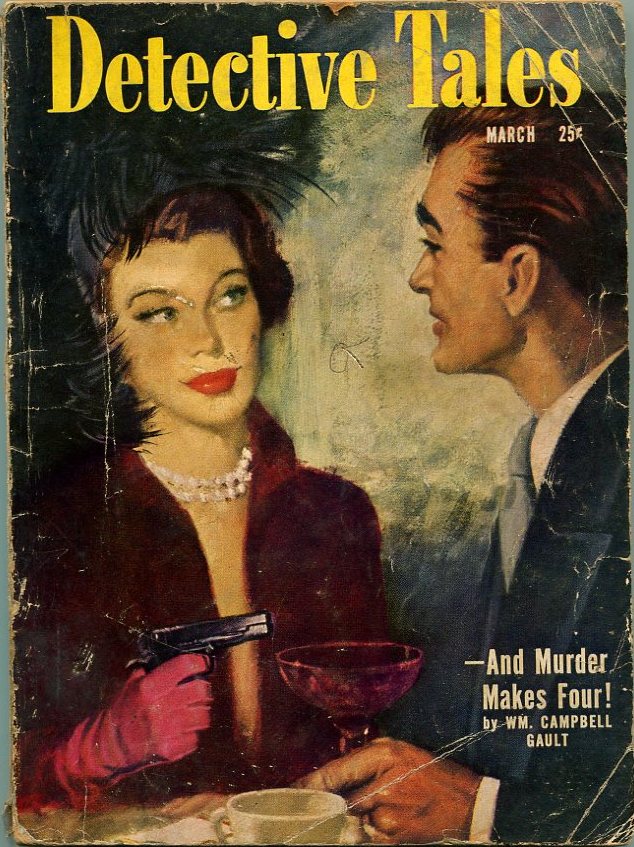
Image resolution: width=634 pixels, height=847 pixels. What are the coordinates of `teacup` in the screenshot? It's located at (256, 815).